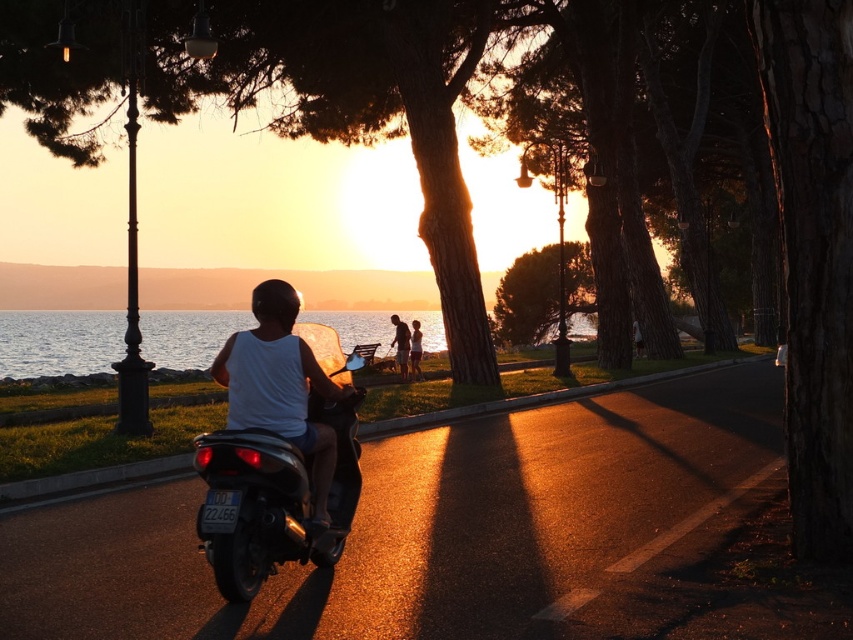
In the scene shown: You are a photographer standing at the waterfront promenade. You want to take a photo of the white matte tank top at center while ensuring it stays within the frame. Given that your camera has a field of view covering coordinates from 0.0 to 1.0 on both axes, will the tank top remain entirely within the frame?

The white matte tank top at center is located at point (x=280, y=385). Since both coordinates are between 0.0 and 1.0, the tank top will remain entirely within the camera frame.

You are standing at the point with coordinates point (231, 365) and want to walk towards the point with coordinates point (408, 342). Which direction should you face to move towards it?

Since point (231, 365) is closer to the camera than point (408, 342), you should face away from the camera to move towards the farther point (408, 342).

You are a photographer trying to capture the sunset scene. You notice two people wearing white tops in the center of the image, a white matte tank top at center and a smooth white shirt at center. Which of the two tops is wider?

The white matte tank top at center is wider than the smooth white shirt at center.